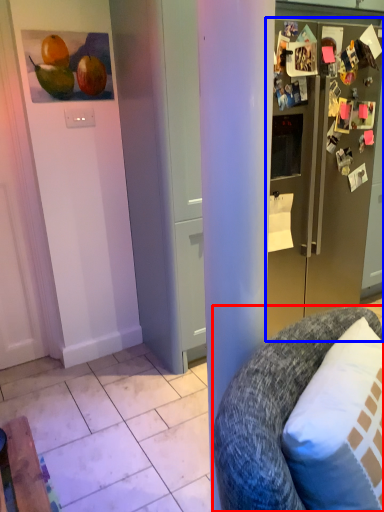
Question: Which object appears farthest to the camera in this image, chair (highlighted by a red box) or refrigerator (highlighted by a blue box)?

Choices:
 (A) chair
 (B) refrigerator

Answer: (B)